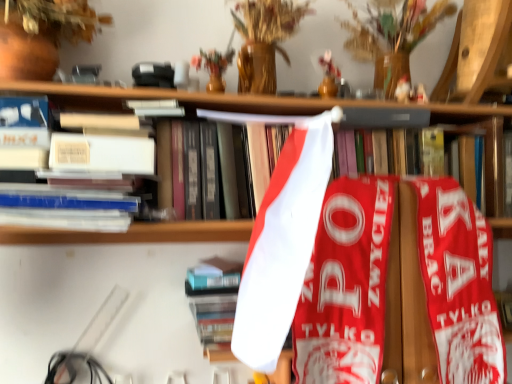
Question: Is hardcover book at center, which is counted as the second book, starting from the top, inside the boundaries of white paper at upper center, positioned as the 1th book in top-to-bottom order, or outside?

Choices:
 (A) outside
 (B) inside

Answer: (A)

Question: From the image's perspective, is hardcover book at center, placed as the first book when sorted from bottom to top, positioned above or below white paper at upper center, positioned as the 1th book in top-to-bottom order?

Choices:
 (A) above
 (B) below

Answer: (B)

Question: Relative to white paper at upper center, positioned as the 1th book in top-to-bottom order, is hardcover book at center, which is counted as the second book, starting from the top, in front or behind?

Choices:
 (A) front
 (B) behind

Answer: (B)

Question: Does point (272, 137) appear closer or farther from the camera than point (187, 276)?

Choices:
 (A) closer
 (B) farther

Answer: (A)

Question: In the image, is white paper at upper center, acting as the second book starting from the bottom, positioned in front of or behind hardcover book at center, placed as the first book when sorted from bottom to top?

Choices:
 (A) front
 (B) behind

Answer: (A)

Question: From a real-world perspective, is white paper at upper center, acting as the second book starting from the bottom, positioned above or below hardcover book at center, which is counted as the second book, starting from the top?

Choices:
 (A) below
 (B) above

Answer: (B)

Question: Is white paper at upper center, positioned as the 1th book in top-to-bottom order, wider or thinner than hardcover book at center, placed as the first book when sorted from bottom to top?

Choices:
 (A) wide
 (B) thin

Answer: (A)